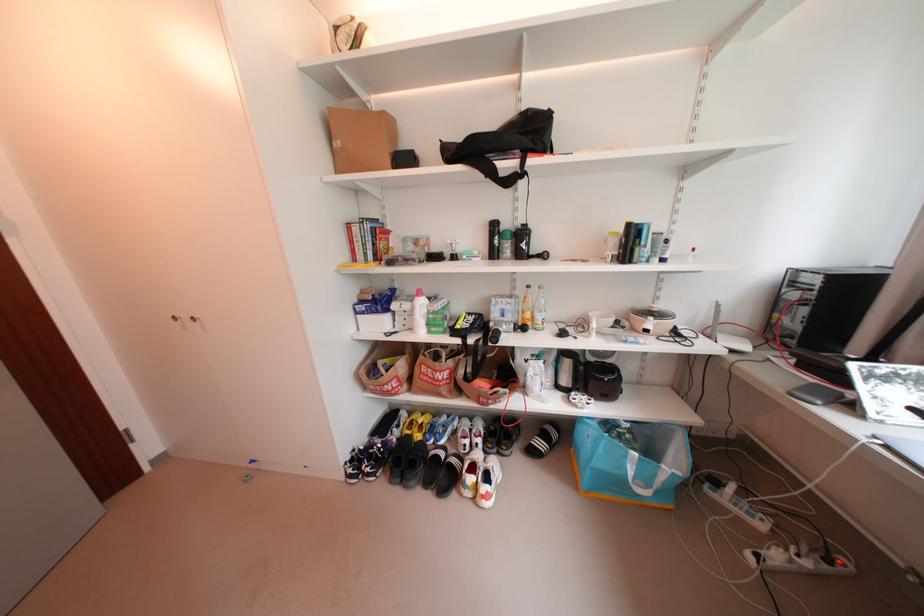
This screenshot has height=616, width=924. What do you see at coordinates (496, 169) in the screenshot?
I see `the black bag strap` at bounding box center [496, 169].